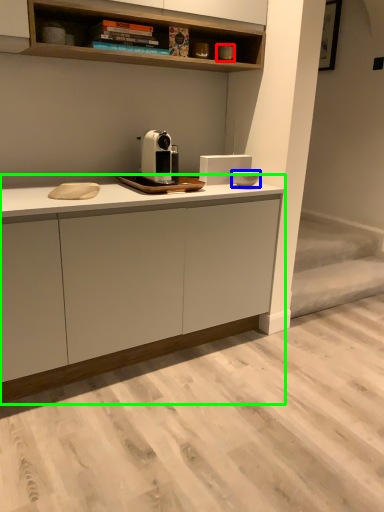
Question: Considering the real-world distances, which object is farthest from appliance (highlighted by a red box)? appliance (highlighted by a blue box) or cabinetry (highlighted by a green box)?

Choices:
 (A) appliance
 (B) cabinetry

Answer: (B)